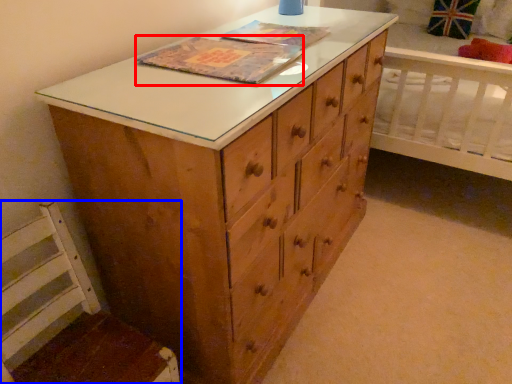
Question: Which object appears farthest to the camera in this image, book cover (highlighted by a red box) or swivel chair (highlighted by a blue box)?

Choices:
 (A) book cover
 (B) swivel chair

Answer: (A)